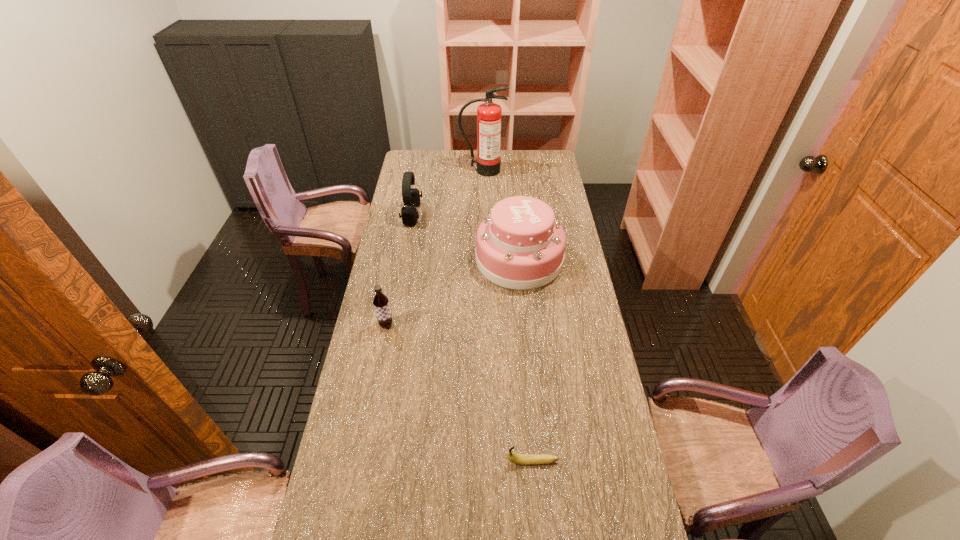
Find the location of a particular element. This screenshot has width=960, height=540. free space that satisfies the following two spatial constraints: 1. on the front-facing side of the tallest object; 2. on the headband of the headset is located at coordinates 483,214.

At what (x,y) coordinates should I click in order to perform the action: click on vacant point that satisfies the following two spatial constraints: 1. on the headband of the fourth nearest object; 2. on the back side of the cake. Please return your answer as a coordinate pair (x, y). The width and height of the screenshot is (960, 540). Looking at the image, I should click on (404, 259).

Find the location of a particular element. The height and width of the screenshot is (540, 960). blank space that satisfies the following two spatial constraints: 1. on the front-facing side of the fire extinguisher; 2. on the left side of the cake is located at coordinates (483, 259).